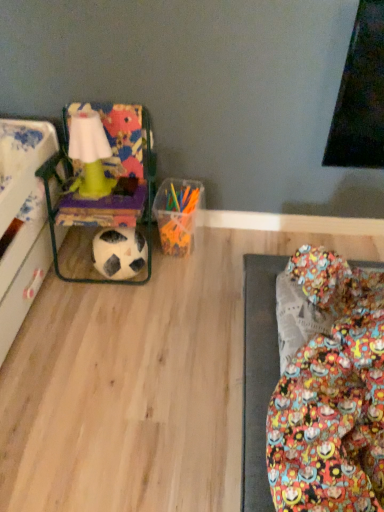
Question: Can you confirm if black matte football at lower left is thinner than multicolored fabric bean bag chair at left?

Choices:
 (A) no
 (B) yes

Answer: (B)

Question: Is black matte football at lower left to the left of multicolored fabric bean bag chair at left from the viewer's perspective?

Choices:
 (A) no
 (B) yes

Answer: (A)

Question: Can you confirm if black matte football at lower left is shorter than multicolored fabric bean bag chair at left?

Choices:
 (A) yes
 (B) no

Answer: (A)

Question: From a real-world perspective, is black matte football at lower left over multicolored fabric bean bag chair at left?

Choices:
 (A) yes
 (B) no

Answer: (B)

Question: Could you tell me if black matte football at lower left is facing multicolored fabric bean bag chair at left?

Choices:
 (A) yes
 (B) no

Answer: (A)

Question: Does black matte football at lower left have a greater height compared to multicolored fabric bean bag chair at left?

Choices:
 (A) no
 (B) yes

Answer: (A)

Question: Can you see multicolored fabric bean bag chair at left touching black matte football at lower left?

Choices:
 (A) no
 (B) yes

Answer: (A)

Question: Considering the relative sizes of multicolored fabric bean bag chair at left and black matte football at lower left in the image provided, is multicolored fabric bean bag chair at left thinner than black matte football at lower left?

Choices:
 (A) no
 (B) yes

Answer: (A)

Question: From the image's perspective, would you say multicolored fabric bean bag chair at left is positioned over black matte football at lower left?

Choices:
 (A) yes
 (B) no

Answer: (A)

Question: Is multicolored fabric bean bag chair at left smaller than black matte football at lower left?

Choices:
 (A) no
 (B) yes

Answer: (A)

Question: Is multicolored fabric bean bag chair at left positioned in front of black matte football at lower left?

Choices:
 (A) yes
 (B) no

Answer: (A)

Question: Is multicolored fabric bean bag chair at left positioned behind black matte football at lower left?

Choices:
 (A) yes
 (B) no

Answer: (B)

Question: From a real-world perspective, relative to black matte football at lower left, is multicolored fabric bean bag chair at left vertically above or below?

Choices:
 (A) above
 (B) below

Answer: (A)